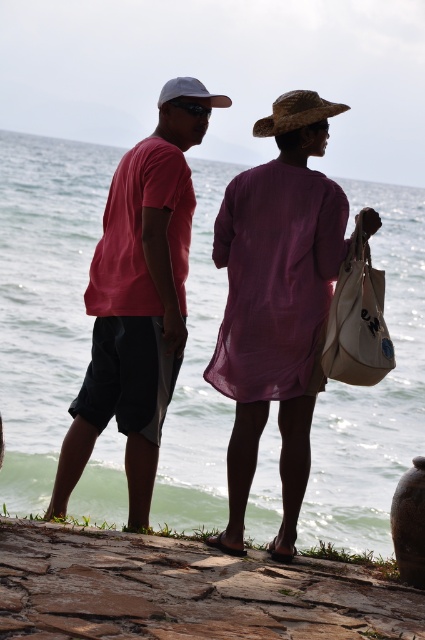
You are a photographer trying to capture a photo of the green water at center and the matte pink shirt at center. Which object will appear larger in the photo if you focus on them equally?

The green water at center will appear larger in the photo because it is taller than the matte pink shirt at center.

You are standing at the edge of the water and want to take a photo of the green water at center. If your camera can focus up to 5 meters, will you be able to capture it clearly?

The green water at center is 6.20 meters away from the camera, which exceeds the camera focus limit of 5 meters. Therefore, the camera cannot capture it clearly.

You are a photographer trying to capture a photo of both the matte purple dress at center and the matte pink shirt at center. Since you want them both in the frame, which direction should you move your camera to include both?

The matte purple dress at center is positioned on the right side of matte pink shirt at center. To include both in the frame, you should move the camera to the left to capture the matte pink shirt at center and then pan to the right to include the matte purple dress at center.